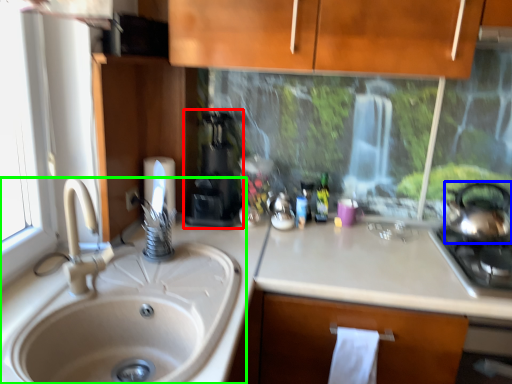
Question: Which is nearer to the coffee machine (highlighted by a red box)? tea pot (highlighted by a blue box) or sink (highlighted by a green box).

Choices:
 (A) tea pot
 (B) sink

Answer: (B)